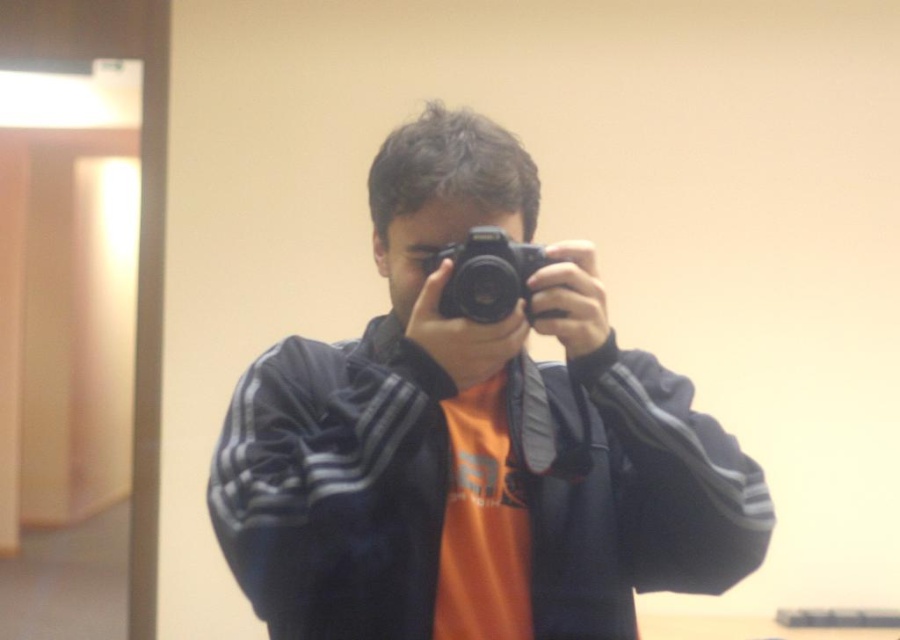
Is black matte camera at center closer to the viewer compared to black plastic camera at center?

That is False.

Is black matte camera at center shorter than black plastic camera at center?

No.

Is point (446, 632) closer to viewer compared to point (513, 285)?

No, (446, 632) is further to viewer.

At what (x,y) coordinates should I click in order to perform the action: click on black matte camera at center. Please return your answer as a coordinate pair (x, y). The image size is (900, 640). Looking at the image, I should click on 473,442.